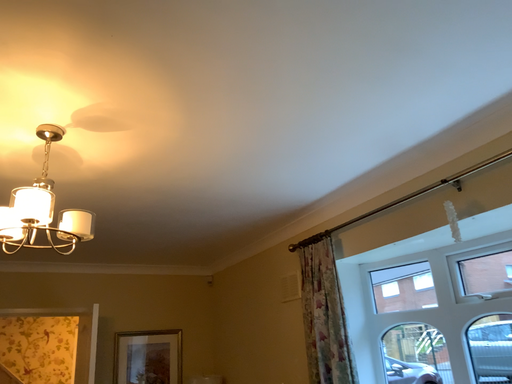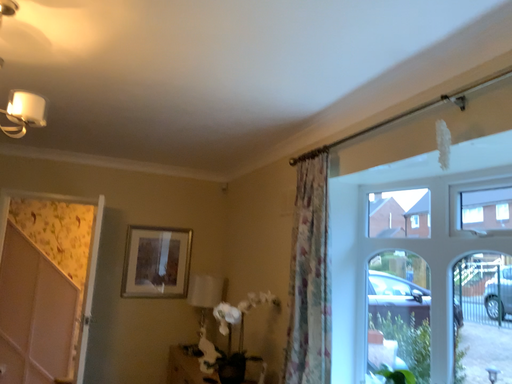
Question: How did the camera likely rotate when shooting the video?

Choices:
 (A) rotated right
 (B) rotated left

Answer: (B)